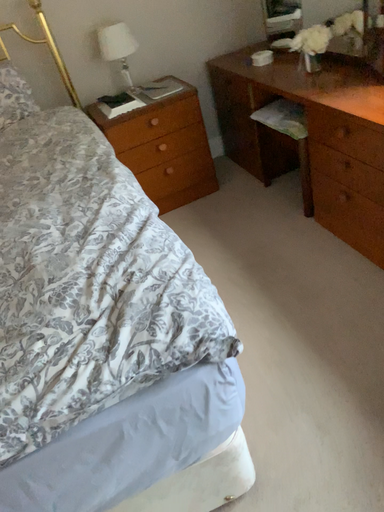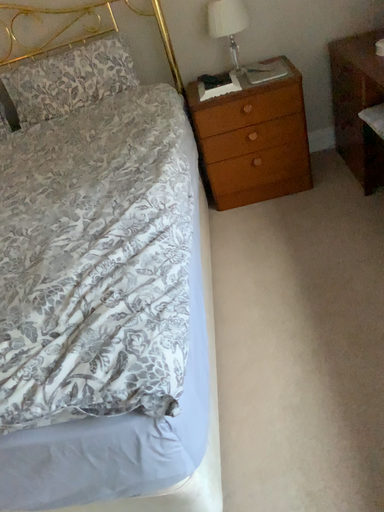
Question: How did the camera likely rotate when shooting the video?

Choices:
 (A) rotated left
 (B) rotated right

Answer: (A)